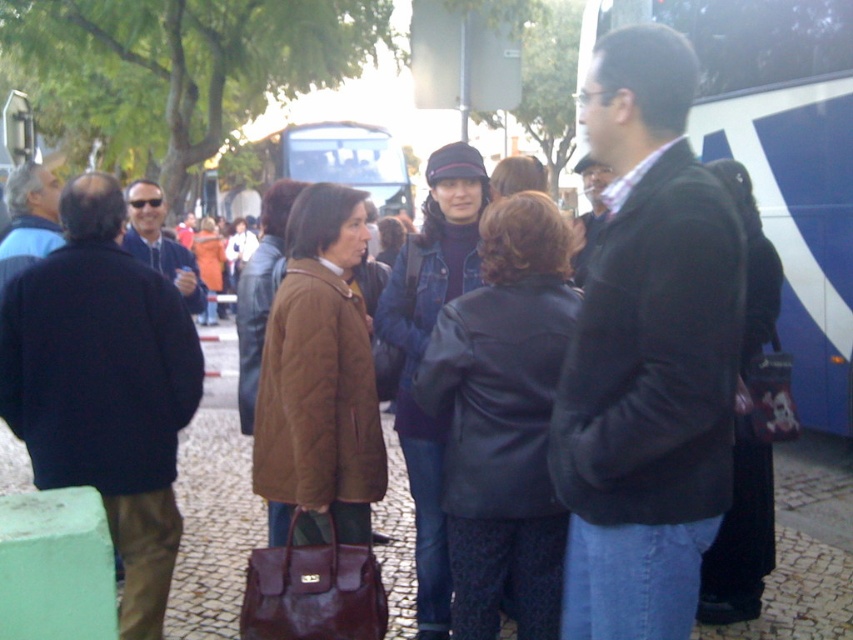
You are a delivery person who needs to place a large package that is 1.2 meters tall. You see the dark brown leather bag at lower left and the blue metallic bus at center. Which object can the package fit under without exceeding its height?

The blue metallic bus at center is taller than the dark brown leather bag at lower left, so the package can fit under the blue metallic bus at center since it is taller.

You are a delivery person who needs to deliver a package to a bus stop. You see two buses in the image, the blue painted bus at right and the blue metallic bus at center. Which bus is closer to the bus stop?

The blue metallic bus at center is closer to the bus stop because the distance between the blue painted bus at right and the blue metallic bus at center is 12.29 meters, so the blue metallic bus at center is closer to the bus stop.